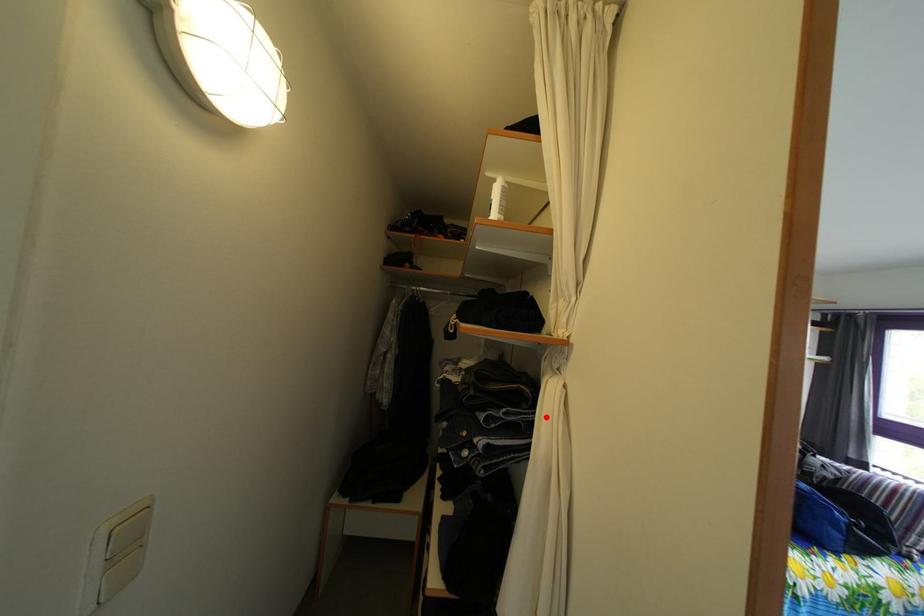
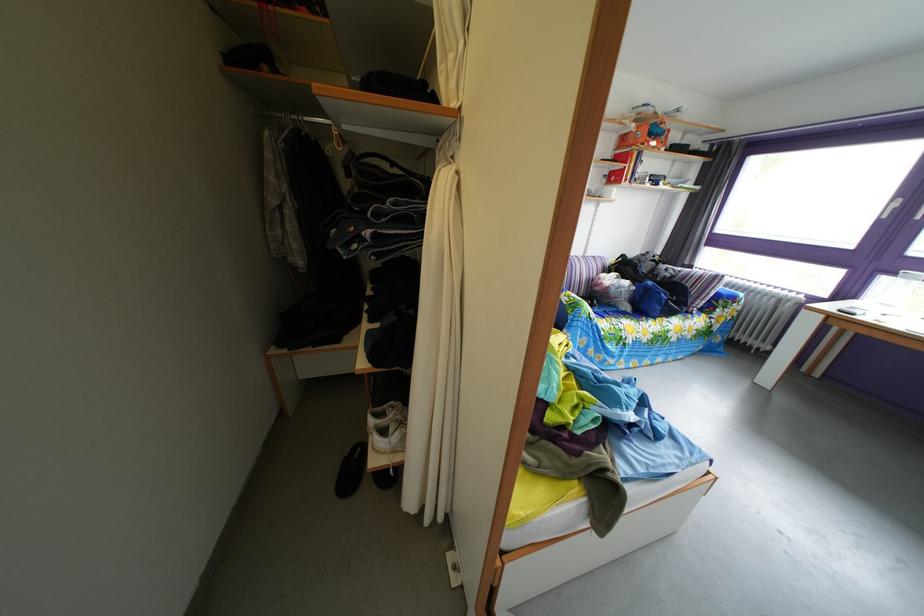
Locate, in the second image, the point that corresponds to the highlighted location in the first image.

(438, 207)